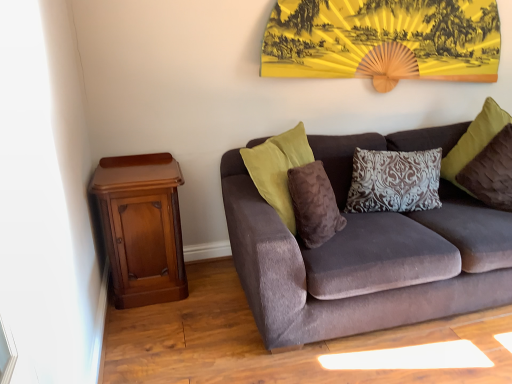
Question: From their relative heights in the image, would you say yellow paper fan at upper center is taller or shorter than brown damask pillow at center, placed as the 2th pillow when sorted from left to right?

Choices:
 (A) short
 (B) tall

Answer: (B)

Question: Considering the positions of point (361, 71) and point (372, 203), is point (361, 71) closer or farther from the camera than point (372, 203)?

Choices:
 (A) farther
 (B) closer

Answer: (A)

Question: Which is farther from the mahogany wood nightstand at left?

Choices:
 (A) yellow paper fan at upper center
 (B) brown damask pillow at center, the 2th pillow viewed from the right
 (C) brown fuzzy pillow at center, positioned as the first pillow in left-to-right order
 (D) velvet brown couch at center
 (E) velvet brown pillow at upper right, marked as the 3th pillow in a left-to-right arrangement

Answer: (E)

Question: Estimate the real-world distances between objects in this image. Which object is farther from the brown damask pillow at center, the 2th pillow viewed from the right?

Choices:
 (A) mahogany wood nightstand at left
 (B) velvet brown pillow at upper right, marked as the 1th pillow in a right-to-left arrangement
 (C) yellow paper fan at upper center
 (D) velvet brown couch at center
 (E) brown fuzzy pillow at center, positioned as the first pillow in left-to-right order

Answer: (A)